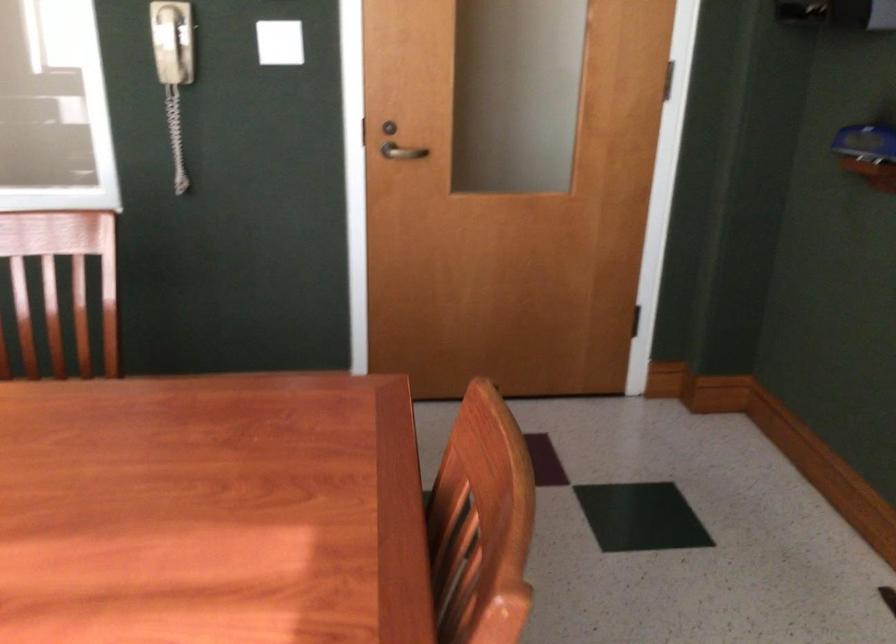
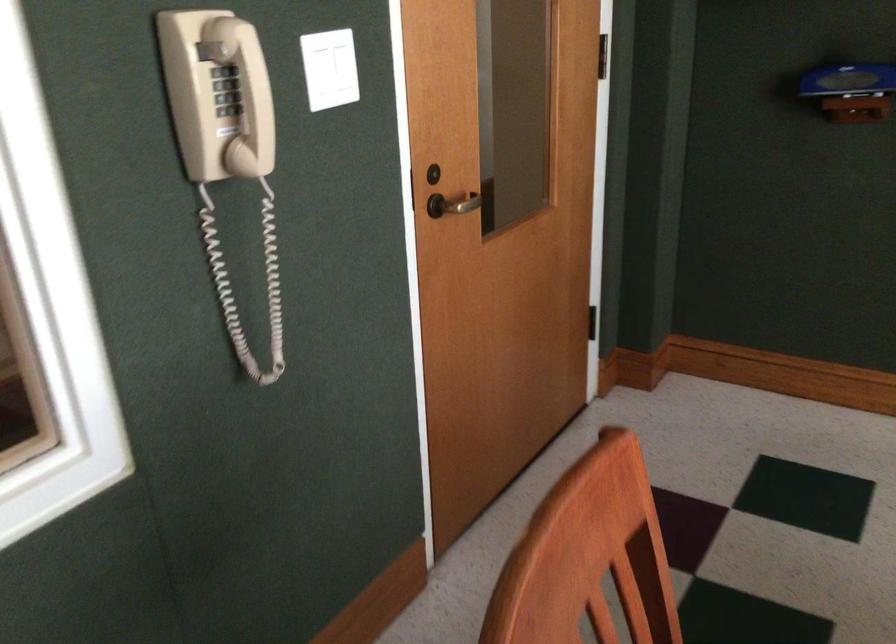
Locate, in the second image, the point that corresponds to point 362,135 in the first image.

(409, 191)